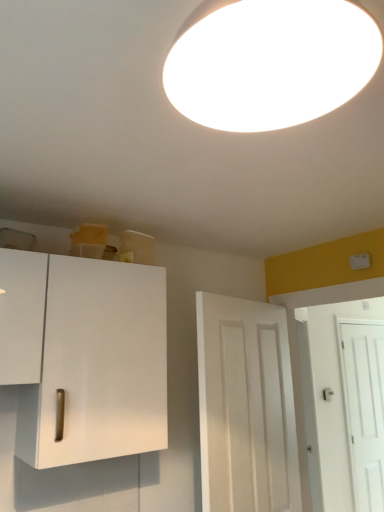
Question: From the image's perspective, would you say white matte cabinet at left is shown under white matte light fixture at upper center?

Choices:
 (A) no
 (B) yes

Answer: (B)

Question: Would you consider white matte cabinet at left to be distant from white matte light fixture at upper center?

Choices:
 (A) no
 (B) yes

Answer: (B)

Question: Is white matte cabinet at left smaller than white matte light fixture at upper center?

Choices:
 (A) yes
 (B) no

Answer: (B)

Question: Is white matte cabinet at left not within white matte light fixture at upper center?

Choices:
 (A) yes
 (B) no

Answer: (A)

Question: Is white matte cabinet at left turned away from white matte light fixture at upper center?

Choices:
 (A) yes
 (B) no

Answer: (B)

Question: Is white matte light fixture at upper center wider or thinner than white matte door at right, the 3th door positioned from the left?

Choices:
 (A) wide
 (B) thin

Answer: (A)

Question: Relative to white matte door at right, the 3th door positioned from the left, is white matte light fixture at upper center in front or behind?

Choices:
 (A) front
 (B) behind

Answer: (A)

Question: Does point (294, 6) appear closer or farther from the camera than point (380, 481)?

Choices:
 (A) farther
 (B) closer

Answer: (B)

Question: From a real-world perspective, is white matte light fixture at upper center above or below white matte door at right, which is the 1th door in back-to-front order?

Choices:
 (A) below
 (B) above

Answer: (B)

Question: Relative to white matte door at right, the 3th door positioned from the left, is white matte door at right, the 2th door when ordered from front to back, in front or behind?

Choices:
 (A) behind
 (B) front

Answer: (B)

Question: From their relative heights in the image, would you say white matte door at right, the 2th door viewed from the right, is taller or shorter than white matte door at right, the third door in the front-to-back sequence?

Choices:
 (A) tall
 (B) short

Answer: (B)

Question: Is white matte door at right, the 2th door when ordered from front to back, inside the boundaries of white matte door at right, which is counted as the first door, starting from the right, or outside?

Choices:
 (A) inside
 (B) outside

Answer: (B)

Question: Looking at their shapes, would you say white matte door at right, which ranks as the 2th door in left-to-right order, is wider or thinner than white matte door at right, the 3th door positioned from the left?

Choices:
 (A) thin
 (B) wide

Answer: (B)

Question: From a real-world perspective, relative to white matte door at right, which ranks as the second door in back-to-front order, is white matte light fixture at upper center vertically above or below?

Choices:
 (A) above
 (B) below

Answer: (A)

Question: Is white matte light fixture at upper center taller or shorter than white matte door at right, which ranks as the second door in back-to-front order?

Choices:
 (A) tall
 (B) short

Answer: (B)